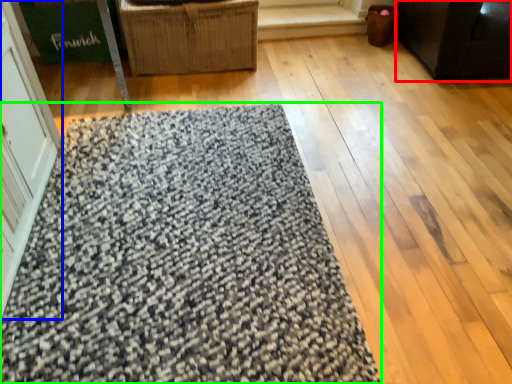
Question: Considering the real-world distances, which object is closest to furniture (highlighted by a red box)? screen door (highlighted by a blue box) or mat (highlighted by a green box).

Choices:
 (A) screen door
 (B) mat

Answer: (B)